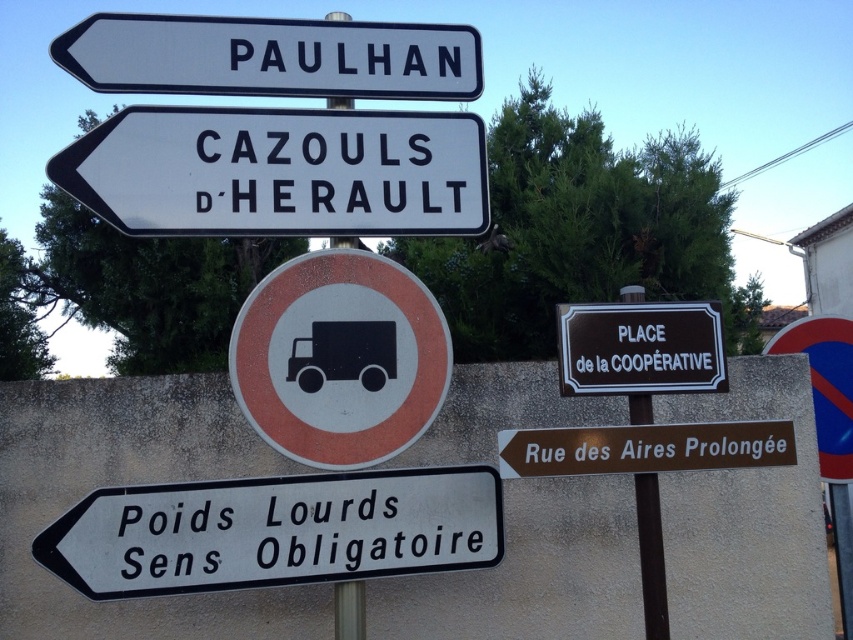
Is point (242, 224) closer to viewer compared to point (355, 604)?

Yes, it is in front of point (355, 604).

Does white plastic sign at upper left have a smaller size compared to metallic pole at center?

Incorrect, white plastic sign at upper left is not smaller in size than metallic pole at center.

Is point (276, 109) behind point (335, 600)?

Yes, it is behind point (335, 600).

Image resolution: width=853 pixels, height=640 pixels. What are the coordinates of `white plastic sign at upper left` in the screenshot? It's located at (280, 172).

Is point (624, 381) farther from camera compared to point (782, 440)?

Yes, point (624, 381) is behind point (782, 440).

Which is behind, point (563, 365) or point (643, 442)?

Positioned behind is point (563, 365).

This screenshot has width=853, height=640. I want to click on brown wooden sign at center, so click(640, 348).

The height and width of the screenshot is (640, 853). What are the coordinates of `brown wooden sign at center` in the screenshot? It's located at (640, 348).

Is point (444, 532) in front of point (76, 48)?

No, (444, 532) is further to viewer.

Is point (370, 534) farther from camera compared to point (260, 65)?

No.

Who is more forward, (x=154, y=580) or (x=148, y=80)?

Point (x=154, y=580) is more forward.

Where is `white plastic sign at lower left`? The width and height of the screenshot is (853, 640). white plastic sign at lower left is located at coordinates (276, 531).